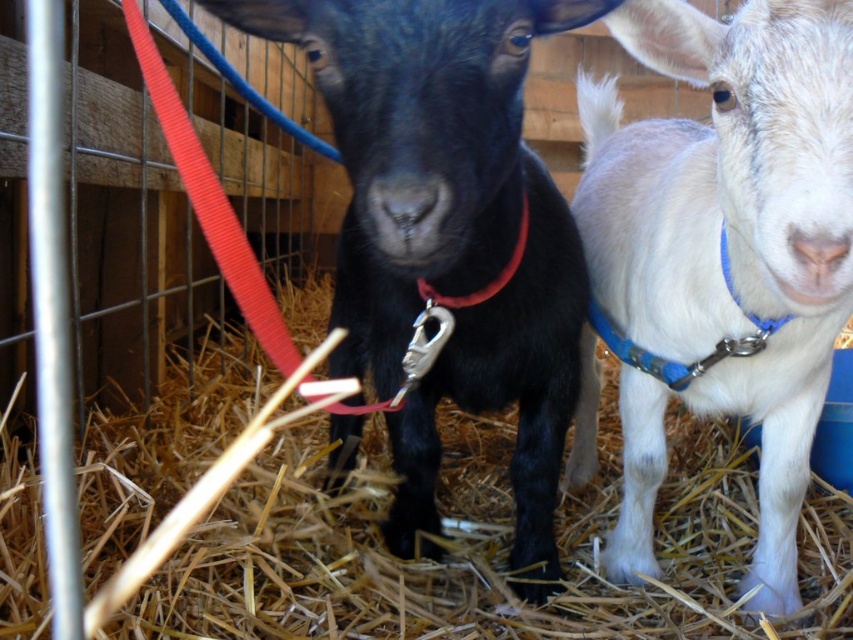
Question: Estimate the real-world distances between objects in this image. Which object is closer to the matte red collar at center?

Choices:
 (A) straw at center
 (B) shiny black goat at center
 (C) white woolen goat at center

Answer: (B)

Question: Is white woolen goat at center further to the viewer compared to shiny black goat at center?

Choices:
 (A) no
 (B) yes

Answer: (A)

Question: Does white woolen goat at center have a greater width compared to matte red collar at center?

Choices:
 (A) yes
 (B) no

Answer: (A)

Question: Which object is the closest to the white woolen goat at center?

Choices:
 (A) straw at center
 (B) shiny black goat at center
 (C) matte red collar at center

Answer: (B)

Question: Which object is positioned closest to the straw at center?

Choices:
 (A) matte red collar at center
 (B) white woolen goat at center
 (C) shiny black goat at center

Answer: (C)

Question: Does straw at center have a greater width compared to matte red collar at center?

Choices:
 (A) no
 (B) yes

Answer: (B)